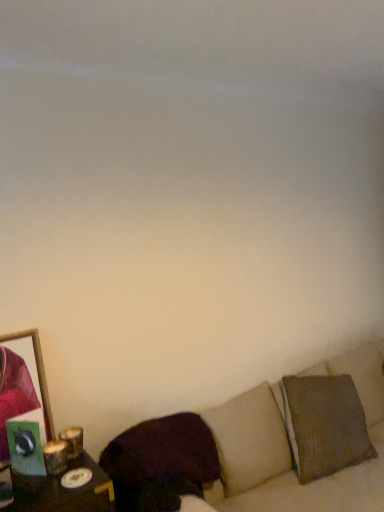
Image resolution: width=384 pixels, height=512 pixels. I want to click on textured beige couch at lower right, so click(x=291, y=444).

The width and height of the screenshot is (384, 512). I want to click on wooden frame at left, so click(x=22, y=383).

Identify the location of textured beige couch at lower right. Image resolution: width=384 pixels, height=512 pixels. (291, 444).

Considering the positions of points (308, 477) and (144, 457), is point (308, 477) closer to camera compared to point (144, 457)?

No, (308, 477) is further to viewer.

Does textured beige couch at lower right contain dark brown fabric pillow at lower center?

Yes, dark brown fabric pillow at lower center is a part of textured beige couch at lower right.

From a real-world perspective, is textured beige couch at lower right located beneath dark brown fabric pillow at lower center?

Yes, from a real-world perspective, textured beige couch at lower right is under dark brown fabric pillow at lower center.

Does textured beige couch at lower right have a larger size compared to dark brown fabric pillow at lower center?

Yes.

From the image's perspective, between dark brown fabric pillow at lower center and wooden frame at left, who is located below?

dark brown fabric pillow at lower center appears lower in the image.

The image size is (384, 512). What are the coordinates of `pillow below the wooden frame at left (from a real-world perspective)` in the screenshot? It's located at (163, 452).

From the picture: Is dark brown fabric pillow at lower center taller or shorter than wooden frame at left?

In the image, dark brown fabric pillow at lower center appears to be shorter than wooden frame at left.

Is wooden frame at left at the back of dark brown fabric pillow at lower center?

No, wooden frame at left is not at the back of dark brown fabric pillow at lower center.

How much distance is there between dark brown fabric pillow at lower center and textured beige couch at lower right?

dark brown fabric pillow at lower center is 22.93 centimeters away from textured beige couch at lower right.

Can you confirm if dark brown fabric pillow at lower center is positioned to the right of textured beige couch at lower right?

No, dark brown fabric pillow at lower center is not to the right of textured beige couch at lower right.

Which is correct: dark brown fabric pillow at lower center is inside textured beige couch at lower right, or outside of it?

dark brown fabric pillow at lower center lies within the bounds of textured beige couch at lower right.

In the image, is dark brown fabric pillow at lower center positioned in front of or behind textured beige couch at lower right?

In the image, dark brown fabric pillow at lower center appears behind textured beige couch at lower right.

Could textured beige couch at lower right be considered to be inside wooden frame at left?

Actually, textured beige couch at lower right is outside wooden frame at left.

Does wooden frame at left have a greater width compared to textured beige couch at lower right?

In fact, wooden frame at left might be narrower than textured beige couch at lower right.

Is wooden frame at left not near textured beige couch at lower right?

That's not correct — wooden frame at left is a little close to textured beige couch at lower right.

From the picture: Can you confirm if wooden frame at left is bigger than textured beige couch at lower right?

Incorrect, wooden frame at left is not larger than textured beige couch at lower right.

This screenshot has height=512, width=384. I want to click on couch that is below the wooden frame at left (from the image's perspective), so click(291, 444).

Choose the correct answer: Is textured beige couch at lower right inside wooden frame at left or outside it?

textured beige couch at lower right exists outside the volume of wooden frame at left.

Is textured beige couch at lower right not close to wooden frame at left?

No, textured beige couch at lower right is in close proximity to wooden frame at left.

Which object is wider, textured beige couch at lower right or wooden frame at left?

Wider between the two is textured beige couch at lower right.

From the image's perspective, which is above, wooden frame at left or dark brown fabric pillow at lower center?

From the image's view, wooden frame at left is above.

Does wooden frame at left turn towards dark brown fabric pillow at lower center?

No, wooden frame at left is not turned towards dark brown fabric pillow at lower center.

Is wooden frame at left closer to camera compared to dark brown fabric pillow at lower center?

No, it is behind dark brown fabric pillow at lower center.

Is wooden frame at left next to dark brown fabric pillow at lower center?

There is a gap between wooden frame at left and dark brown fabric pillow at lower center.

Where is `couch that is in front of the dark brown fabric pillow at lower center`? The width and height of the screenshot is (384, 512). couch that is in front of the dark brown fabric pillow at lower center is located at coordinates (291, 444).

The height and width of the screenshot is (512, 384). I want to click on pillow located below the wooden frame at left (from the image's perspective), so click(163, 452).

From the picture: When comparing their distances from dark brown fabric pillow at lower center, does textured beige couch at lower right or wooden frame at left seem further?

The object further to dark brown fabric pillow at lower center is wooden frame at left.

Considering their positions, is textured beige couch at lower right positioned further to wooden frame at left than dark brown fabric pillow at lower center?

textured beige couch at lower right is positioned further to the anchor wooden frame at left.

When comparing their distances from wooden frame at left, does dark brown fabric pillow at lower center or textured beige couch at lower right seem closer?

dark brown fabric pillow at lower center lies closer to wooden frame at left than the other object.

Estimate the real-world distances between objects in this image. Which object is closer to textured beige couch at lower right, dark brown fabric pillow at lower center or wooden frame at left?

dark brown fabric pillow at lower center is closer to textured beige couch at lower right.

From the image, which object appears to be nearer to textured beige couch at lower right, wooden frame at left or dark brown fabric pillow at lower center?

dark brown fabric pillow at lower center is closer to textured beige couch at lower right.

Considering their positions, is wooden frame at left positioned closer to dark brown fabric pillow at lower center than textured beige couch at lower right?

textured beige couch at lower right is positioned closer to the anchor dark brown fabric pillow at lower center.

The width and height of the screenshot is (384, 512). I want to click on pillow situated between wooden frame at left and textured beige couch at lower right from left to right, so click(x=163, y=452).